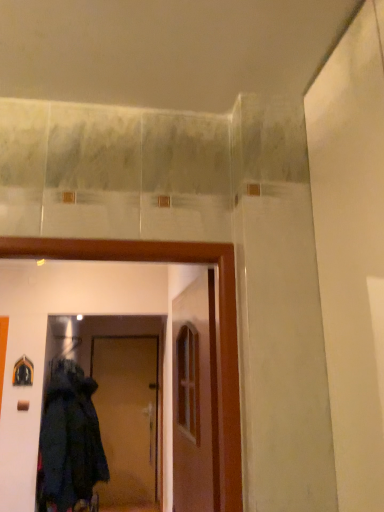
Question: Relative to wooden door at center, which is the first door in right-to-left order, is dark woolen coat at lower left in front or behind?

Choices:
 (A) front
 (B) behind

Answer: (B)

Question: From a real-world perspective, is dark woolen coat at lower left above or below wooden door at center, which is the 2th door from back to front?

Choices:
 (A) below
 (B) above

Answer: (A)

Question: Which of these objects is positioned closest to the brown matte door at center, arranged as the first door when ordered from the bottom?

Choices:
 (A) dark woolen coat at lower left
 (B) wooden door at center, which is the 2th door from back to front

Answer: (A)

Question: Estimate the real-world distances between objects in this image. Which object is farther from the dark woolen coat at lower left?

Choices:
 (A) wooden door at center, marked as the second door in a bottom-to-top arrangement
 (B) brown matte door at center, which appears as the 1th door when viewed from the left

Answer: (B)